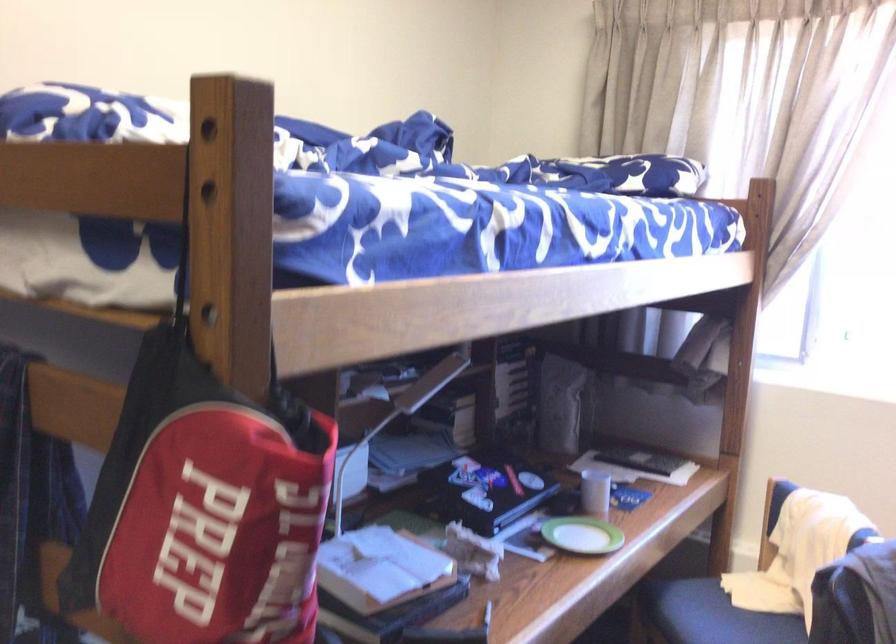
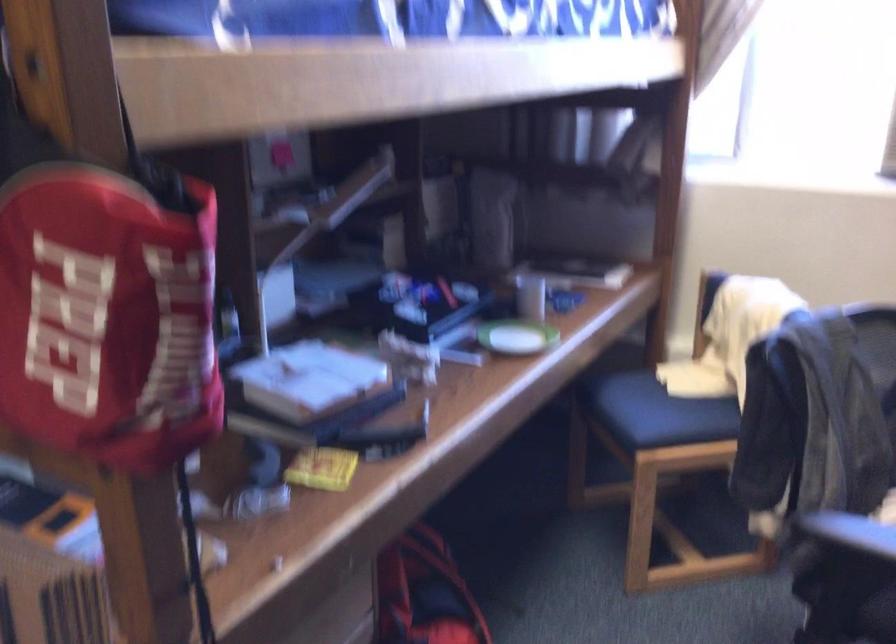
The point at (x=377, y=569) is marked in the first image. Where is the corresponding point in the second image?

(309, 380)